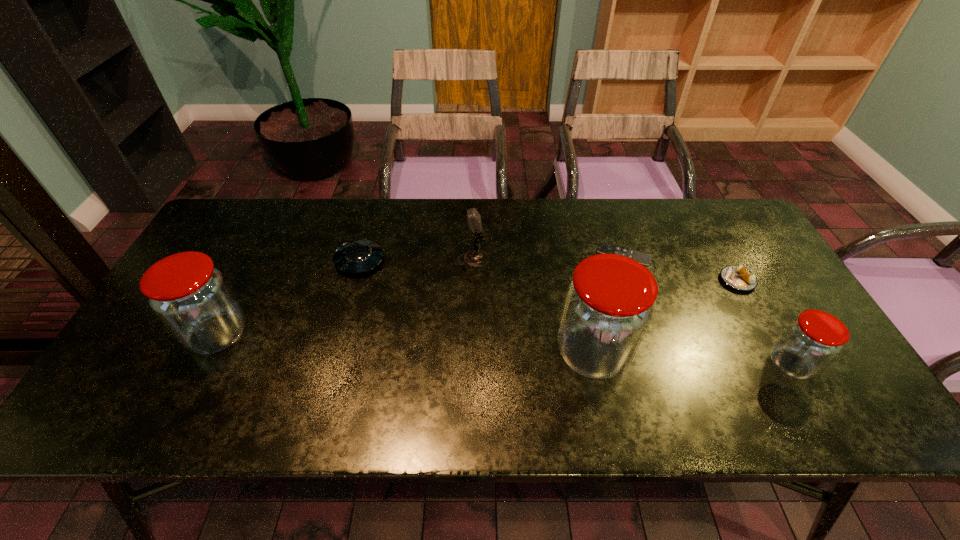
Find the location of `unoccupied area between the second jar from right to left and the second tallest object`. unoccupied area between the second jar from right to left and the second tallest object is located at coordinates (405, 345).

This screenshot has width=960, height=540. Identify the location of free area in between the sixth shortest object and the remote control. (421, 295).

Identify the location of free space between the remote control and the sixth shortest object. (421, 295).

Where is `free space between the fourth shortest object and the second jar from left to right`? free space between the fourth shortest object and the second jar from left to right is located at coordinates (692, 359).

Find the location of a particular element. empty space between the second object from left to right and the remote control is located at coordinates (492, 258).

The height and width of the screenshot is (540, 960). I want to click on vacant region between the second object from left to right and the microphone, so click(x=417, y=261).

The image size is (960, 540). Identify the location of free point between the second jar from left to right and the shortest jar. (692, 359).

Locate which object ranks third in proximity to the pastry. Please provide its 2D coordinates. Your answer should be formatted as a tuple, i.e. [(x, y)], where the tuple contains the x and y coordinates of a point satisfying the conditions above.

[(609, 303)]

Point out which object is positioned as the fifth nearest to the sixth shortest object. Please provide its 2D coordinates. Your answer should be formatted as a tuple, i.e. [(x, y)], where the tuple contains the x and y coordinates of a point satisfying the conditions above.

[(737, 277)]

Locate an element on the screen. This screenshot has height=540, width=960. jar that is the closest to the remote control is located at coordinates (609, 303).